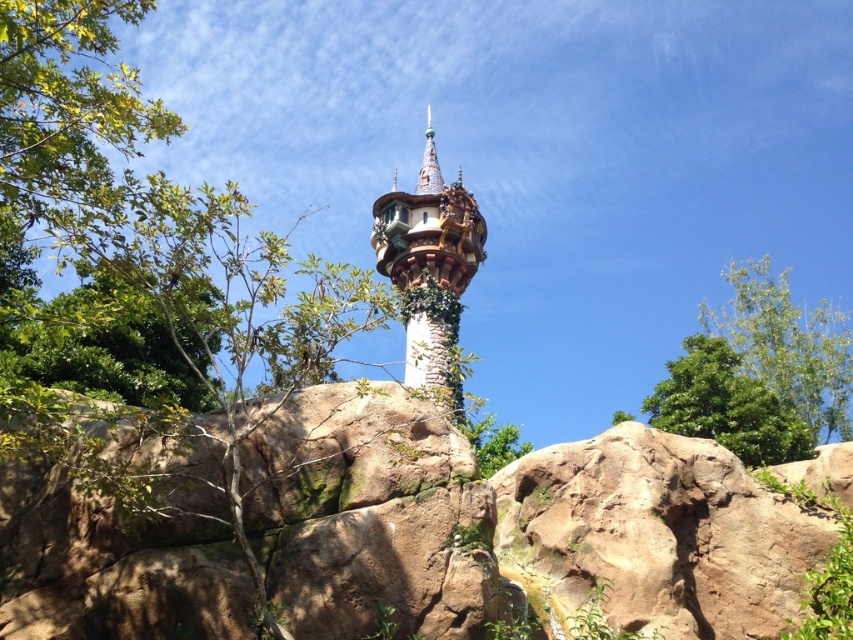
You are an architect designing a new garden layout. You have to place a statue exactly halfway between the white stone tower at center and the green leafy tree at upper right. Will the statue be closer to the tower or the tree?

The statue will be closer to the white stone tower at center because its width is less than the green leafy tree at upper right, so the distance between them depends on their sizes. However, since the question is about placement halfway between their positions, not their sizes, the answer should focus on their spatial positions. Wait, the Objects Description says the tower is narrower than the tree. Hmm, maybe the question is about the statue being placed halfway between them, so the distance would be the 5

You are standing in front of the fairy tale tower and want to take a photo. There are two points marked on the tower, point (425,307) and point (724,397). Which point is closer to your camera?

Point (425,307) is further to the camera than point (724,397). Therefore, point (724,397) is closer to the camera.

Based on the scene description, where is the green leafy tree at upper left located in terms of coordinates?

The green leafy tree at upper left is located at coordinates point (165, 230).